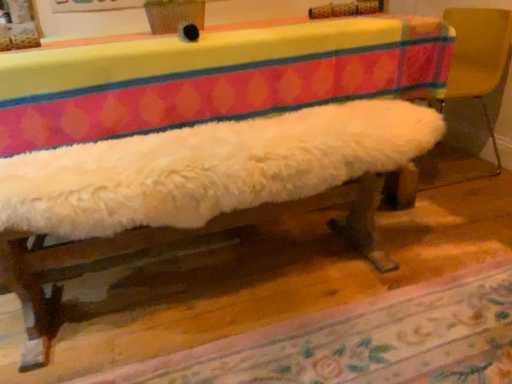
The image size is (512, 384). What do you see at coordinates (478, 58) in the screenshot?
I see `white fluffy cushion at right` at bounding box center [478, 58].

The width and height of the screenshot is (512, 384). In order to click on white fluffy cushion at right in this screenshot , I will do `click(478, 58)`.

Image resolution: width=512 pixels, height=384 pixels. What do you see at coordinates (362, 341) in the screenshot? I see `floral carpet at lower center` at bounding box center [362, 341].

Find the location of `floral carpet at lower center`. floral carpet at lower center is located at coordinates (362, 341).

Where is `white fluffy cushion at right`? The width and height of the screenshot is (512, 384). white fluffy cushion at right is located at coordinates [x=478, y=58].

Considering the relative positions of floral carpet at lower center and white fluffy cushion at right in the image provided, is floral carpet at lower center to the right of white fluffy cushion at right from the viewer's perspective?

No.

Is floral carpet at lower center in front of or behind white fluffy cushion at right in the image?

In the image, floral carpet at lower center appears in front of white fluffy cushion at right.

Is point (377, 325) closer or farther from the camera than point (475, 57)?

Clearly, point (377, 325) is closer to the camera than point (475, 57).

From the image's perspective, would you say floral carpet at lower center is positioned over white fluffy cushion at right?

No, from the image's perspective, floral carpet at lower center is not on top of white fluffy cushion at right.

From a real-world perspective, is floral carpet at lower center over white fluffy cushion at right?

No.

Considering the sizes of objects floral carpet at lower center and white fluffy cushion at right in the image provided, who is wider, floral carpet at lower center or white fluffy cushion at right?

floral carpet at lower center is wider.

Looking at this image, which of these two, floral carpet at lower center or white fluffy cushion at right, stands shorter?

floral carpet at lower center.

Is floral carpet at lower center smaller than white fluffy cushion at right?

Correct, floral carpet at lower center occupies less space than white fluffy cushion at right.

Would you say floral carpet at lower center is outside white fluffy cushion at right?

floral carpet at lower center is positioned outside white fluffy cushion at right.

Are floral carpet at lower center and white fluffy cushion at right located far from each other?

floral carpet at lower center is far away from white fluffy cushion at right.

Is floral carpet at lower center facing towards white fluffy cushion at right?

No, floral carpet at lower center does not turn towards white fluffy cushion at right.

At what (x,y) coordinates should I click in order to perform the action: click on armchair that appears on the right of floral carpet at lower center. Please return your answer as a coordinate pair (x, y). Looking at the image, I should click on (478, 58).

Would you say white fluffy cushion at right is to the left or to the right of floral carpet at lower center in the picture?

In the image, white fluffy cushion at right appears on the right side of floral carpet at lower center.

Considering the relative positions of white fluffy cushion at right and floral carpet at lower center in the image provided, is white fluffy cushion at right behind floral carpet at lower center?

Yes.

Is point (481, 75) more distant than point (103, 382)?

Yes.

From the image's perspective, is white fluffy cushion at right above floral carpet at lower center?

Correct, white fluffy cushion at right appears higher than floral carpet at lower center in the image.

From a real-world perspective, is white fluffy cushion at right physically located above or below floral carpet at lower center?

Clearly, from a real-world perspective, white fluffy cushion at right is above floral carpet at lower center.

In terms of width, does white fluffy cushion at right look wider or thinner when compared to floral carpet at lower center?

white fluffy cushion at right is thinner than floral carpet at lower center.

Is white fluffy cushion at right taller than floral carpet at lower center?

Yes, white fluffy cushion at right is taller than floral carpet at lower center.

Considering the sizes of objects white fluffy cushion at right and floral carpet at lower center in the image provided, who is bigger, white fluffy cushion at right or floral carpet at lower center?

white fluffy cushion at right is bigger.

Could floral carpet at lower center be considered to be inside white fluffy cushion at right?

No.

Is white fluffy cushion at right with floral carpet at lower center?

No, white fluffy cushion at right is not in contact with floral carpet at lower center.

Is white fluffy cushion at right facing towards floral carpet at lower center?

No, white fluffy cushion at right is not aimed at floral carpet at lower center.

You are a GUI agent. You are given a task and a screenshot of the screen. Output one action in this format:
    pyautogui.click(x=<x>, y=<y>)
    Task: Click on the armchair behind the floral carpet at lower center
    
    Given the screenshot: What is the action you would take?
    pyautogui.click(x=478, y=58)

Identify the location of mat in front of the white fluffy cushion at right. The image size is (512, 384). (362, 341).

Locate an element on the screen. The image size is (512, 384). armchair on the right of floral carpet at lower center is located at coordinates (478, 58).